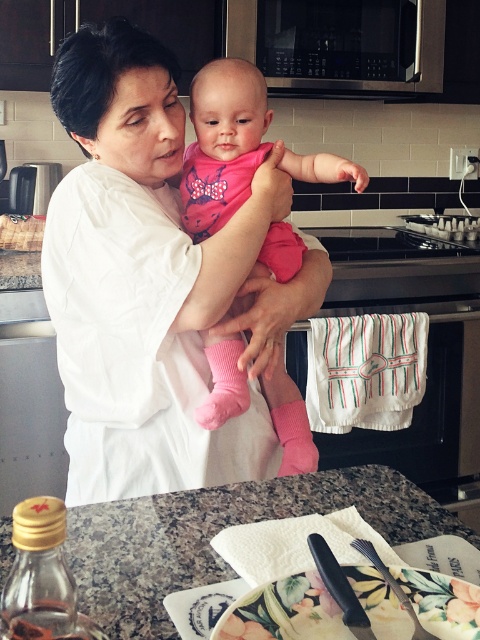
You are a photographer setting up a shoot in this kitchen scene. You need to decide which object, the white matte shirt at center or the pink fabric baby at center, requires more space in the frame to capture its details. Which one should you focus on?

The white matte shirt at center is bigger than the pink fabric baby at center, so you should focus on capturing the white matte shirt at center to accommodate its larger size.

You are a parent trying to place a small toy on the granite countertop at center. However, there is a pink fabric baby at center in the way. Can you move the toy to the countertop without disturbing the baby?

The granite countertop at center is located below the pink fabric baby at center, so you can place the toy on the granite countertop at center without disturbing the baby as the baby is above it.